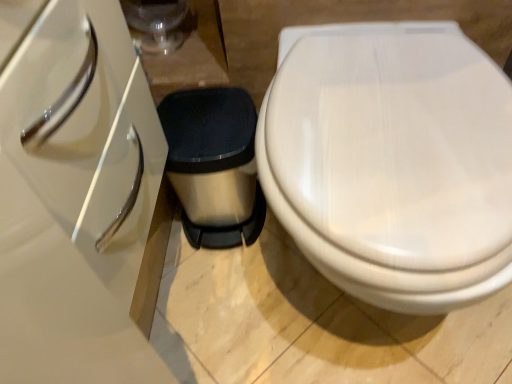
At what (x,y) coordinates should I click in order to perform the action: click on free point above white glossy toilet at right (from a real-world perspective). Please return your answer as a coordinate pair (x, y). Looking at the image, I should click on (357, 143).